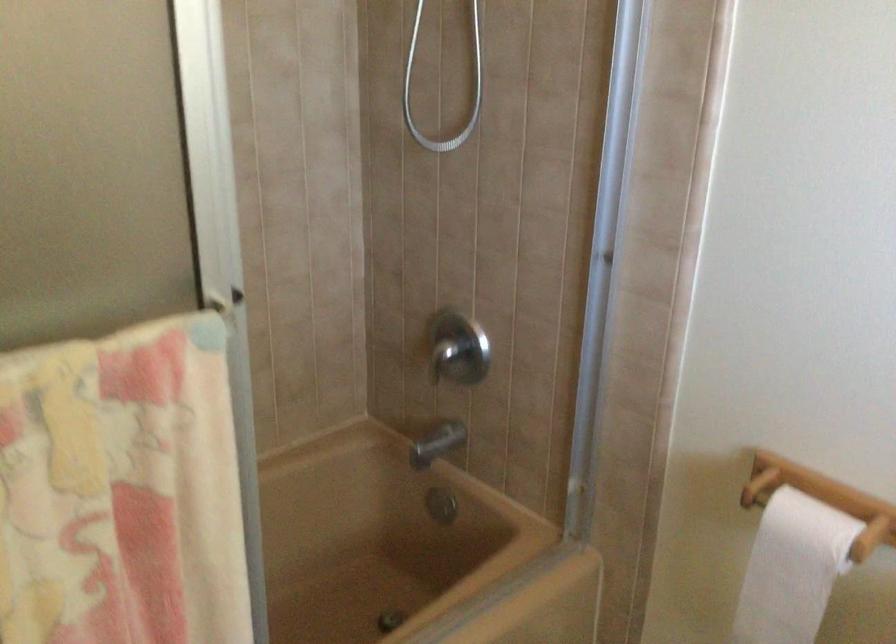
Where would you slid the shower door handle? Please return your answer as a coordinate pair (x, y).

(222, 310)